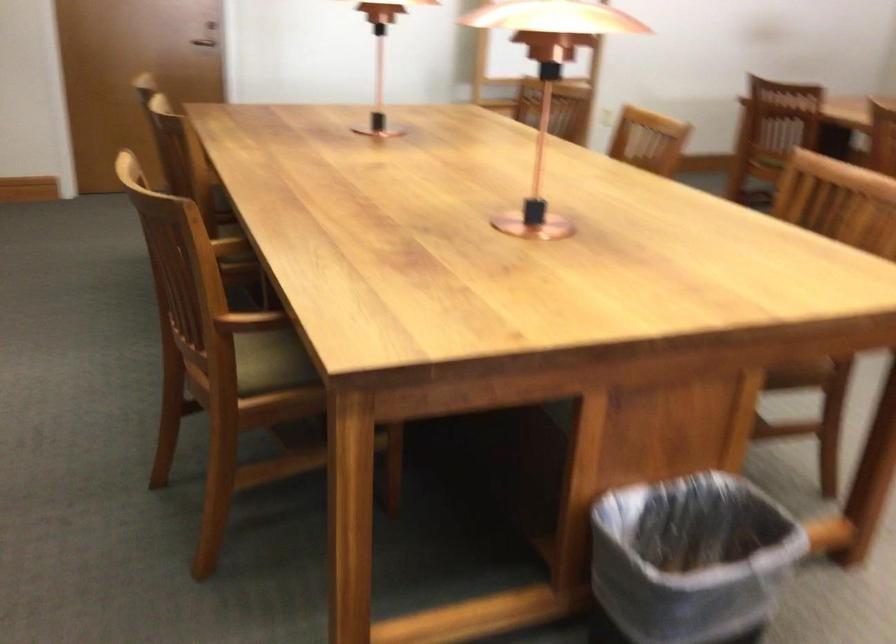
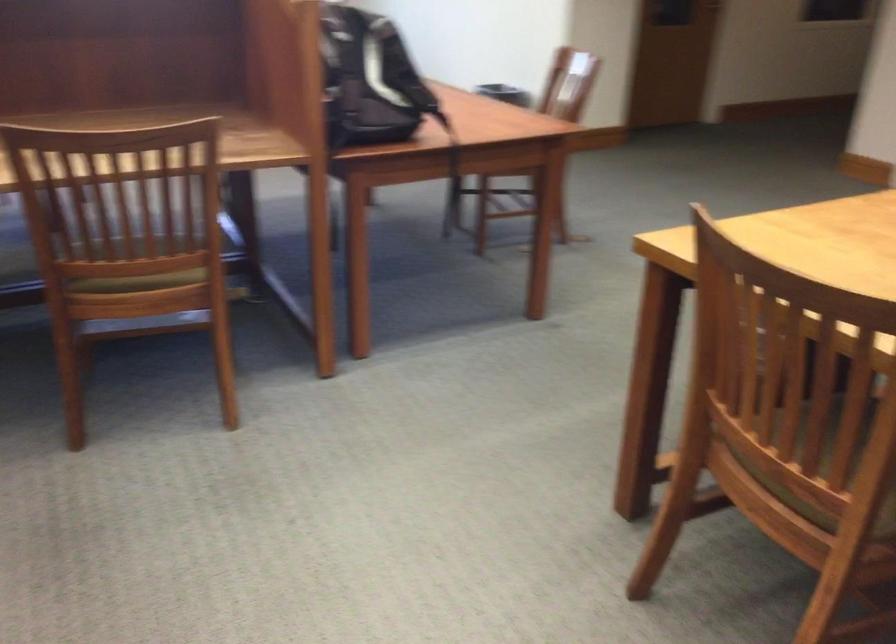
Question: I am providing you with two images of the same scene from different viewpoints. Which of the following objects are not visible in image2?

Choices:
 (A) black backpack
 (B) chair sitting surface
 (C) yellow drill handle
 (D) trash can

Answer: (D)